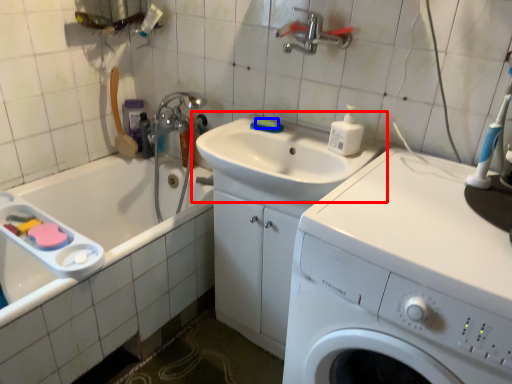
Question: Among these objects, which one is nearest to the camera, sink (highlighted by a red box) or soap (highlighted by a blue box)?

Choices:
 (A) sink
 (B) soap

Answer: (A)